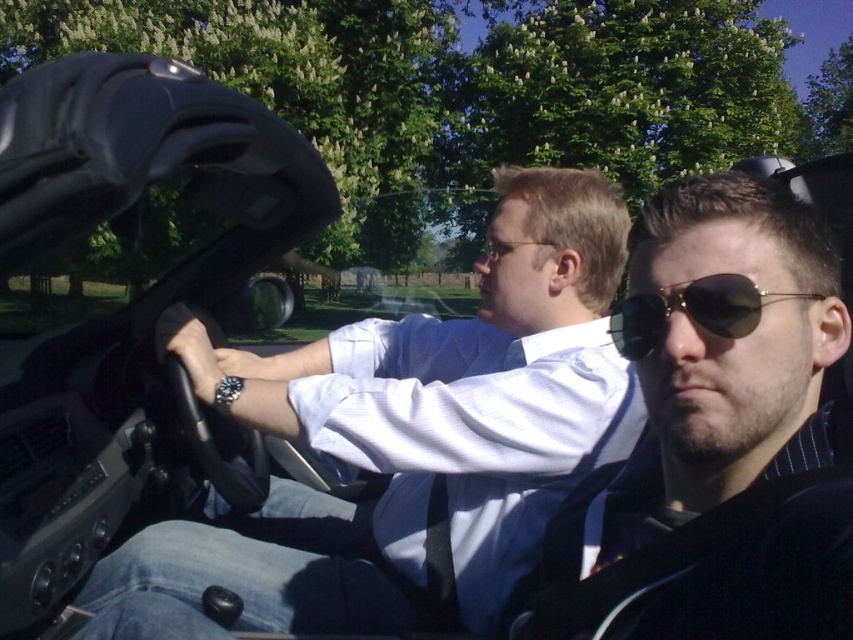
Can you confirm if matte black sunglasses at center is positioned below gold reflective sunglasses at center?

Yes, matte black sunglasses at center is below gold reflective sunglasses at center.

Does matte black sunglasses at center have a greater height compared to gold reflective sunglasses at center?

Indeed, matte black sunglasses at center has a greater height compared to gold reflective sunglasses at center.

This screenshot has height=640, width=853. What are the coordinates of `matte black sunglasses at center` in the screenshot? It's located at (720, 433).

Can you confirm if white shirt at center is positioned to the left of gold reflective sunglasses at center?

Correct, you'll find white shirt at center to the left of gold reflective sunglasses at center.

Does white shirt at center come in front of gold reflective sunglasses at center?

No, white shirt at center is behind gold reflective sunglasses at center.

Is point (614, 403) positioned in front of point (683, 289)?

No, it is behind (683, 289).

I want to click on white shirt at center, so click(408, 440).

Does white shirt at center appear over matte black sunglasses at center?

Correct, white shirt at center is located above matte black sunglasses at center.

Between point (468, 452) and point (741, 324), which one is positioned behind?

Positioned behind is point (468, 452).

At what (x,y) coordinates should I click in order to perform the action: click on white shirt at center. Please return your answer as a coordinate pair (x, y). The width and height of the screenshot is (853, 640). Looking at the image, I should click on pos(408,440).